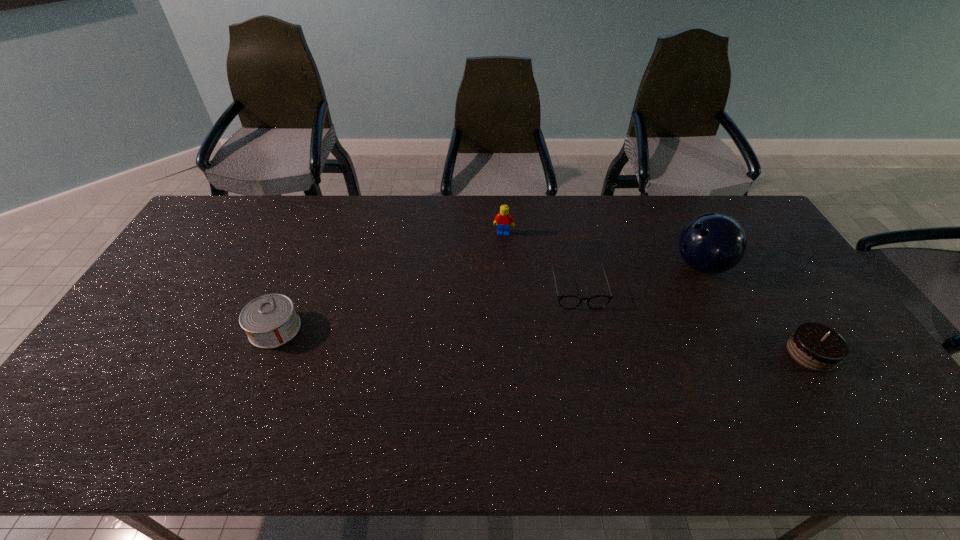
I want to click on free location located 0.130m on the right of the second shortest object, so click(x=347, y=329).

Where is `free space located on the left of the third shortest object`? The image size is (960, 540). free space located on the left of the third shortest object is located at coordinates (x=707, y=353).

Where is `free location located 0.090m through the lenses of the third object from right to left`? Image resolution: width=960 pixels, height=540 pixels. free location located 0.090m through the lenses of the third object from right to left is located at coordinates (588, 335).

What are the coordinates of `vacant position located through the lenses of the third object from right to left` in the screenshot? It's located at (602, 396).

Where is `vacant region located 0.140m through the lenses of the third object from right to left`? The height and width of the screenshot is (540, 960). vacant region located 0.140m through the lenses of the third object from right to left is located at coordinates (591, 349).

Find the location of a particular element. This screenshot has width=960, height=540. free space located 0.200m on the surface of the tallest object near the finger holes is located at coordinates (636, 302).

I want to click on free spot located 0.170m on the surface of the tallest object near the finger holes, so (643, 298).

This screenshot has width=960, height=540. What are the coordinates of `free spot located on the surface of the tallest object near the finger holes` in the screenshot? It's located at (668, 284).

Where is `vacant space positioned on the face of the farthest object`? This screenshot has height=540, width=960. vacant space positioned on the face of the farthest object is located at coordinates (488, 293).

The width and height of the screenshot is (960, 540). Find the location of `vacant position located on the face of the farthest object`. vacant position located on the face of the farthest object is located at coordinates (484, 310).